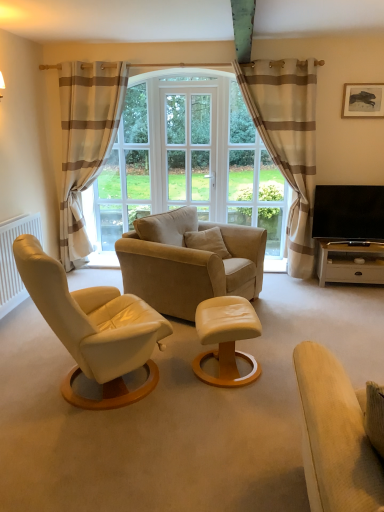
You are a GUI agent. You are given a task and a screenshot of the screen. Output one action in this format:
    pyautogui.click(x=<x>, y=<y>)
    Task: Click on the vacant space to the right of suede beige armchair at center
    This screenshot has height=512, width=384.
    Given the screenshot: What is the action you would take?
    pyautogui.click(x=321, y=320)